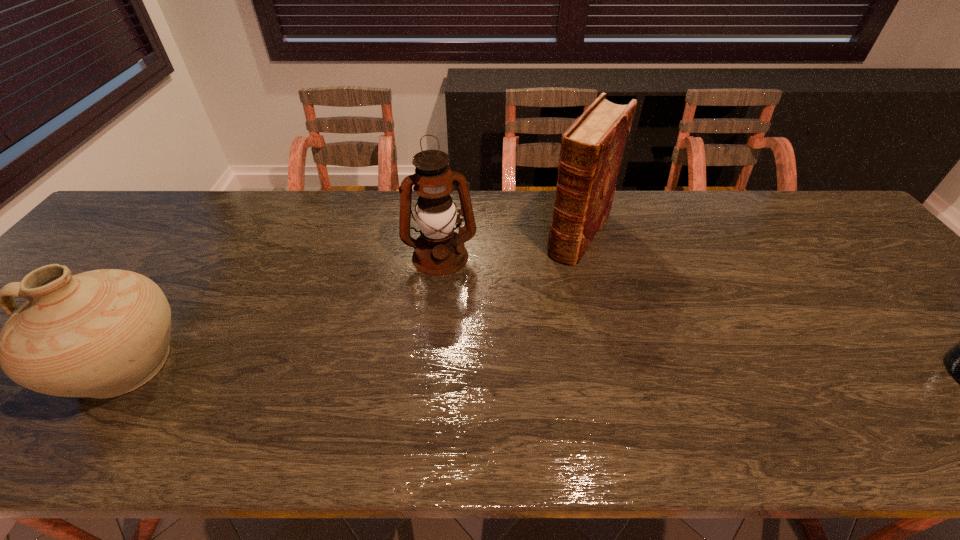
Find the location of a particular element. This screenshot has height=540, width=960. free space on the desktop that is between the second shortest object and the shortest object and is positioned on the side of the lantern, there is a wick adjustment knob is located at coordinates (451, 369).

In order to click on free space on the desktop that is between the second shortest object and the mug and is positioned on the spine side of the third object from left to right in this screenshot , I will do `click(488, 369)`.